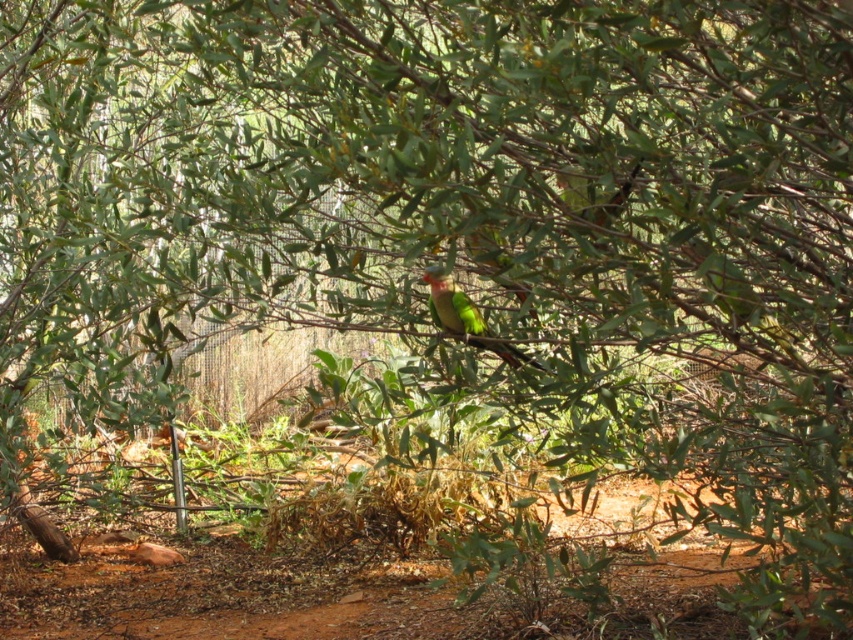
You are a photographer standing at the edge of the dirt field at lower center, aiming to capture the green matte parrot at center in your shot. Based on their heights, will the parrot be fully visible above the dirt field in your photo?

The dirt field at lower center has a greater height compared to the green matte parrot at center, so the parrot might be partially or fully obscured by the dirt field in the photo.

You are a photographer standing in the bushland and want to take a photo of the green matte parrot at center. However, you notice the dirt field at lower center is blocking your view. Can you move closer to the parrot without stepping on the dirt field?

The dirt field at lower center is further to the viewer than the green matte parrot at center, so moving closer to the parrot would require stepping onto the dirt field. Therefore, you cannot move closer without stepping on it.